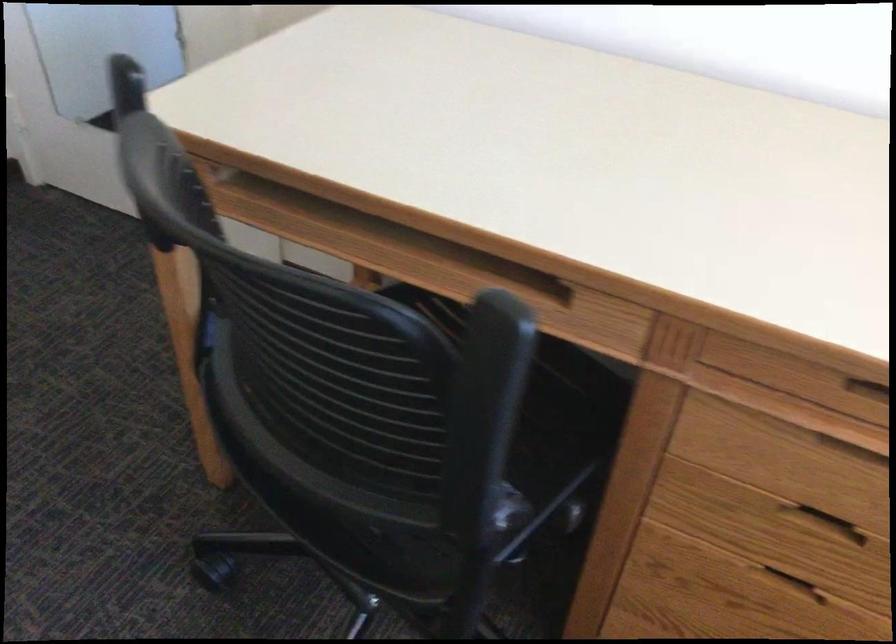
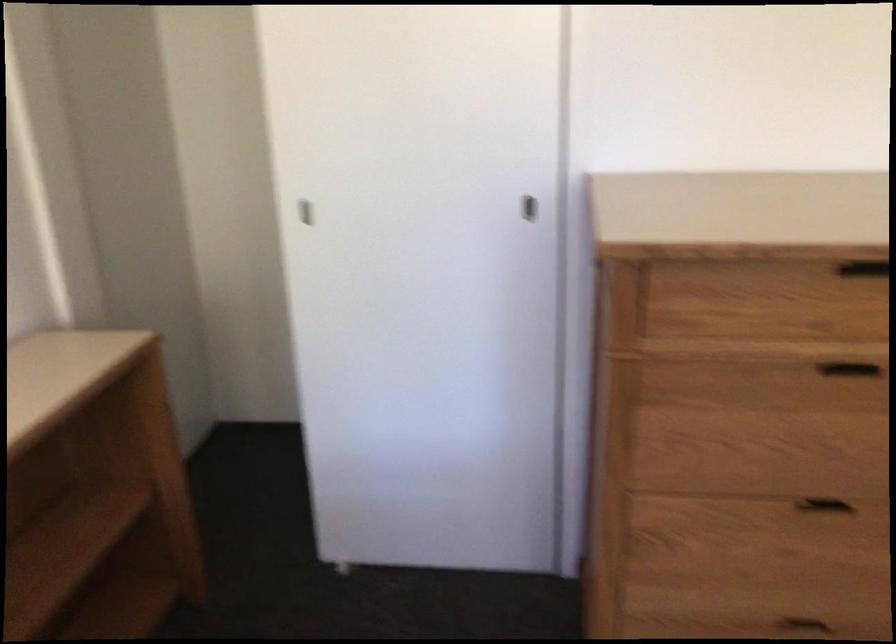
Question: The camera is either moving clockwise (left) or counter-clockwise (right) around the object. The first image is from the beginning of the video and the second image is from the end. Is the camera moving left or right when shooting the video?

Choices:
 (A) Left
 (B) Right

Answer: (B)